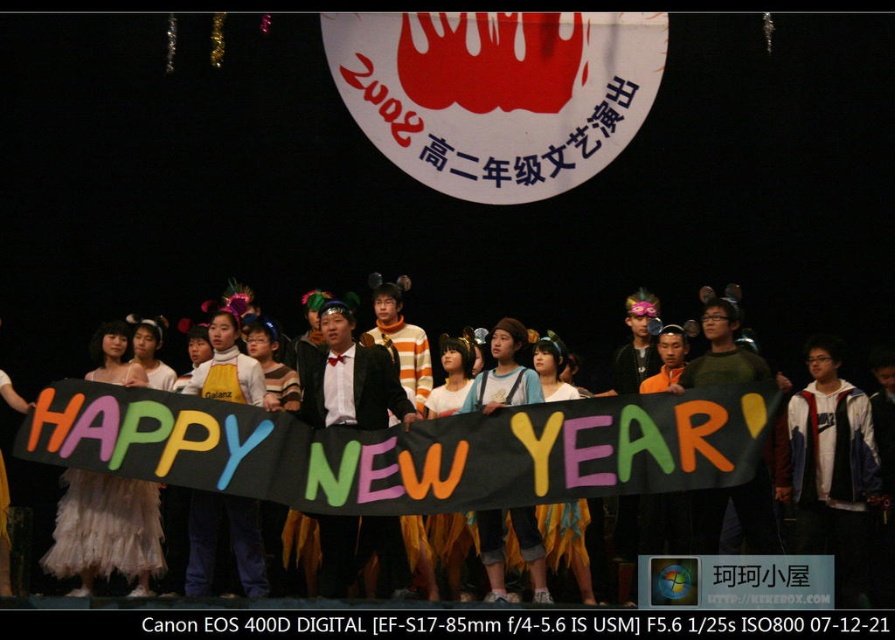
Between white matte dress at center and white fluffy dress at center, which one has more height?

With more height is white matte dress at center.

Between white matte dress at center and white fluffy dress at center, which one is positioned lower?

white fluffy dress at center is lower down.

This screenshot has width=895, height=640. Find the location of `white matte dress at center`. white matte dress at center is located at coordinates (420, 451).

Find the location of a particular element. This screenshot has width=895, height=640. white matte dress at center is located at coordinates (420, 451).